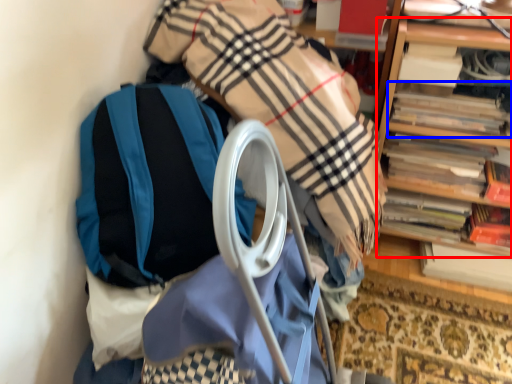
Question: Which of the following is the farthest to the observer, shelf (highlighted by a red box) or book (highlighted by a blue box)?

Choices:
 (A) shelf
 (B) book

Answer: (B)